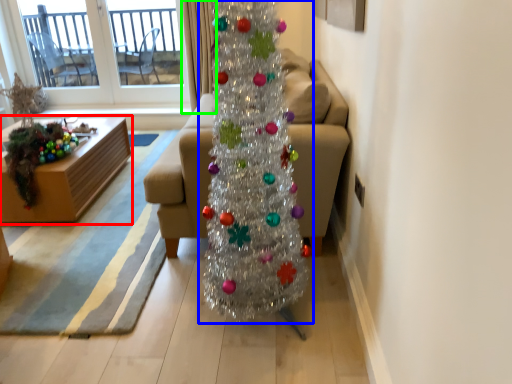
Question: Considering the real-world distances, which object is farthest from furniture (highlighted by a red box)? christmas tree (highlighted by a blue box) or curtain (highlighted by a green box)?

Choices:
 (A) christmas tree
 (B) curtain

Answer: (A)